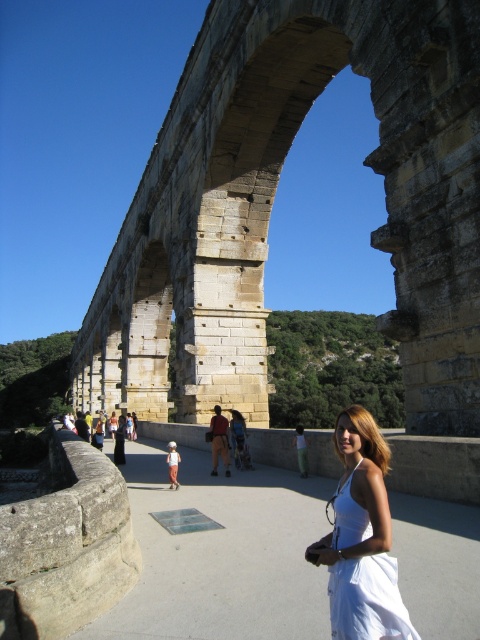
You are standing at the base of the aqueduct and want to take a photo of the woman in the white cotton dress at center. The camera you have can focus on subjects up to 100 feet away. Will you be able to capture her clearly?

The white cotton dress at center and viewer are 70.86 feet apart from each other. Since the camera can focus up to 100 feet, you can capture her clearly as the distance is within range.

You are a photographer planning to take a picture of the stone arch bridge at center and the brown leather jacket at center. Based on their sizes in the scene, which object will appear larger in your photo?

The stone arch bridge at center will appear larger in the photo because it is much taller than the brown leather jacket at center, as stated in the description.